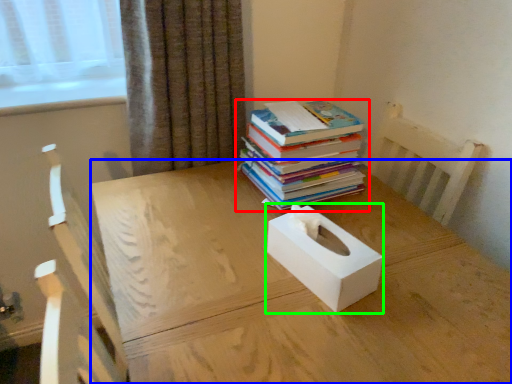
Question: Considering the real-world distances, which object is farthest from book (highlighted by a red box)? desk (highlighted by a blue box) or box (highlighted by a green box)?

Choices:
 (A) desk
 (B) box

Answer: (B)